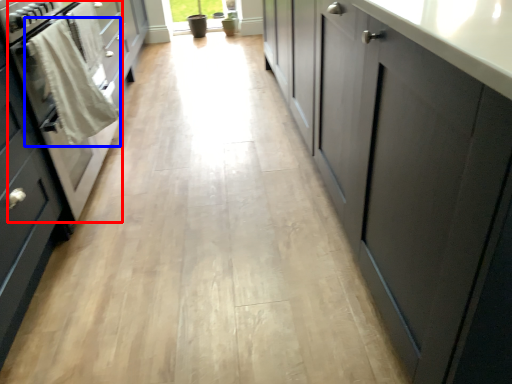
Question: Which object appears closest to the camera in this image, oven (highlighted by a red box) or laundry (highlighted by a blue box)?

Choices:
 (A) oven
 (B) laundry

Answer: (A)